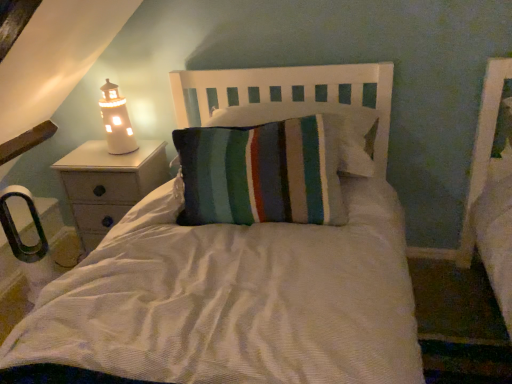
Question: Considering the relative sizes of white ceramic lighthouse at left and white wood nightstand at left in the image provided, is white ceramic lighthouse at left smaller than white wood nightstand at left?

Choices:
 (A) yes
 (B) no

Answer: (A)

Question: Is white ceramic lighthouse at left located outside white wood nightstand at left?

Choices:
 (A) no
 (B) yes

Answer: (B)

Question: Considering the relative positions of white ceramic lighthouse at left and white wood nightstand at left in the image provided, is white ceramic lighthouse at left to the right of white wood nightstand at left from the viewer's perspective?

Choices:
 (A) no
 (B) yes

Answer: (B)

Question: Can you confirm if white ceramic lighthouse at left is thinner than white wood nightstand at left?

Choices:
 (A) yes
 (B) no

Answer: (A)

Question: Does white ceramic lighthouse at left lie in front of white wood nightstand at left?

Choices:
 (A) no
 (B) yes

Answer: (B)

Question: Could white wood nightstand at left be considered to be inside white ceramic lighthouse at left?

Choices:
 (A) no
 (B) yes

Answer: (A)

Question: Is white wood nightstand at left located within white wood headboard at center?

Choices:
 (A) no
 (B) yes

Answer: (A)

Question: From a real-world perspective, does white wood headboard at center stand above white wood nightstand at left?

Choices:
 (A) yes
 (B) no

Answer: (A)

Question: Considering the relative sizes of white wood headboard at center and white wood nightstand at left in the image provided, is white wood headboard at center shorter than white wood nightstand at left?

Choices:
 (A) no
 (B) yes

Answer: (B)

Question: Can you confirm if white wood headboard at center is positioned to the right of white wood nightstand at left?

Choices:
 (A) yes
 (B) no

Answer: (A)

Question: From the image's perspective, is white wood headboard at center below white wood nightstand at left?

Choices:
 (A) no
 (B) yes

Answer: (A)

Question: Is white wood headboard at center wider than white wood nightstand at left?

Choices:
 (A) no
 (B) yes

Answer: (B)

Question: Is white wood headboard at center wider than white ceramic lighthouse at left?

Choices:
 (A) yes
 (B) no

Answer: (A)